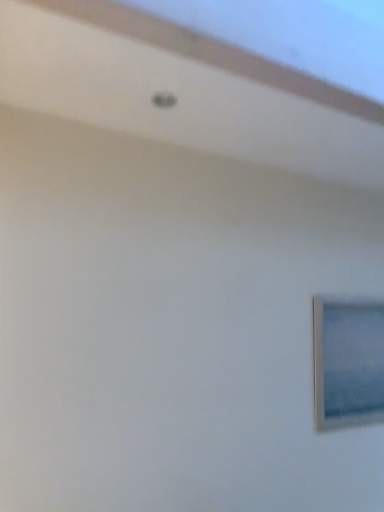
At what (x,y) coordinates should I click in order to perform the action: click on white plastic picture frame at lower right. Please return your answer as a coordinate pair (x, y). Looking at the image, I should click on (348, 364).

What do you see at coordinates (348, 364) in the screenshot? The image size is (384, 512). I see `white plastic picture frame at lower right` at bounding box center [348, 364].

Where is `white plastic picture frame at lower right`? white plastic picture frame at lower right is located at coordinates (348, 364).